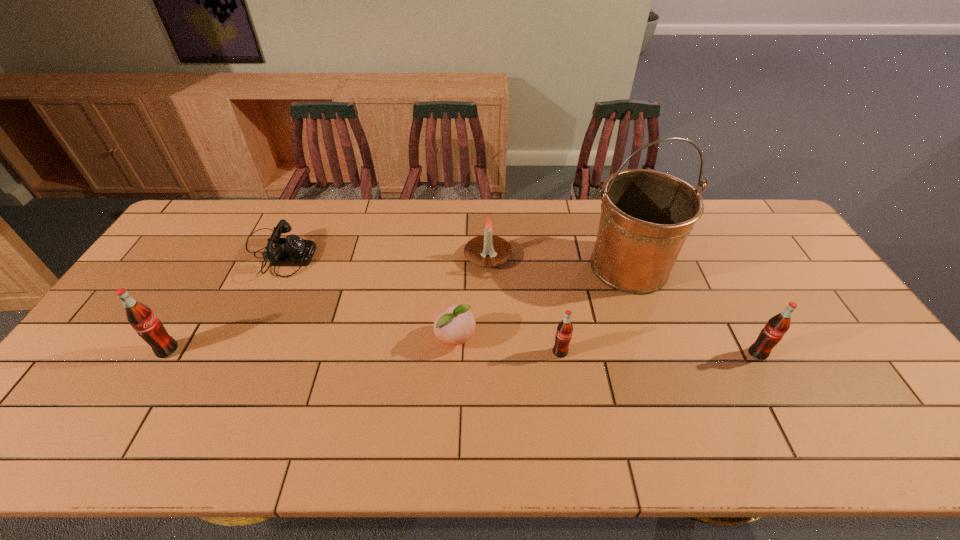
If we want them evenly spaced by inserting an extra pop_(soda) among them, please locate a free spot for this new pop_(soda). Please provide its 2D coordinates. Your answer should be formatted as a tuple, i.e. [(x, y)], where the tuple contains the x and y coordinates of a point satisfying the conditions above.

[(364, 352)]